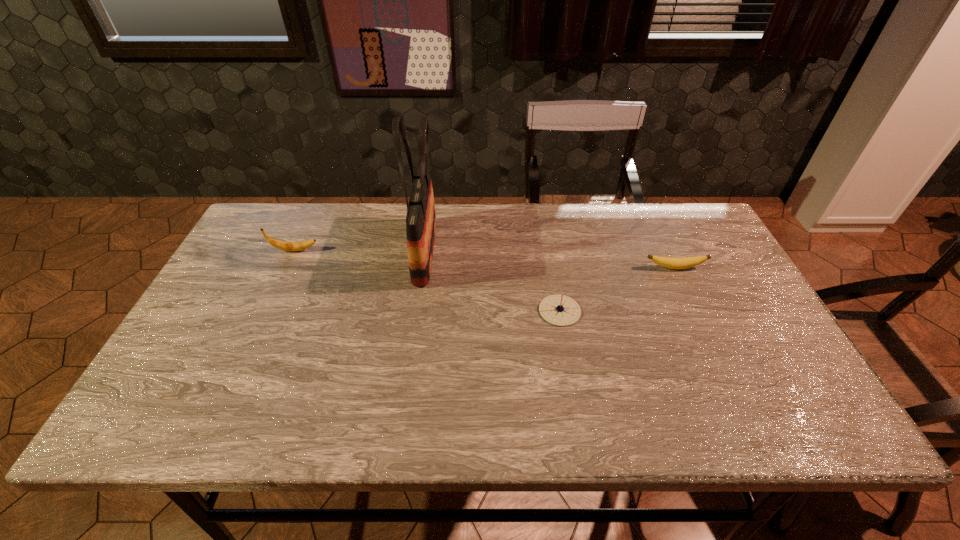
The height and width of the screenshot is (540, 960). In the image, there is a desktop. Find the location of `blank space at the right edge`. blank space at the right edge is located at coordinates (698, 296).

This screenshot has height=540, width=960. In order to click on vacant space at the far left corner in this screenshot , I will do `click(294, 241)`.

In the image, there is a desktop. At what (x,y) coordinates should I click in order to perform the action: click on vacant space at the near left corner. Please return your answer as a coordinate pair (x, y). Looking at the image, I should click on (163, 409).

At what (x,y) coordinates should I click in order to perform the action: click on vacant position at the far right corner of the desktop. Please return your answer as a coordinate pair (x, y). The height and width of the screenshot is (540, 960). Looking at the image, I should click on click(658, 220).

Locate an element on the screen. Image resolution: width=960 pixels, height=540 pixels. vacant area between the tallest object and the compass is located at coordinates coord(492,281).

Where is `free spot between the right banana and the second object from right to left`? free spot between the right banana and the second object from right to left is located at coordinates 617,289.

Where is `empty space that is in between the right banana and the left banana`? This screenshot has height=540, width=960. empty space that is in between the right banana and the left banana is located at coordinates (485, 259).

Identify the location of free point between the shorter banana and the farther banana. Image resolution: width=960 pixels, height=540 pixels. (485, 259).

What are the coordinates of `empty space between the shortest object and the leftmost object` in the screenshot? It's located at (485, 259).

This screenshot has height=540, width=960. In order to click on free space between the right banana and the compass in this screenshot , I will do `click(617, 289)`.